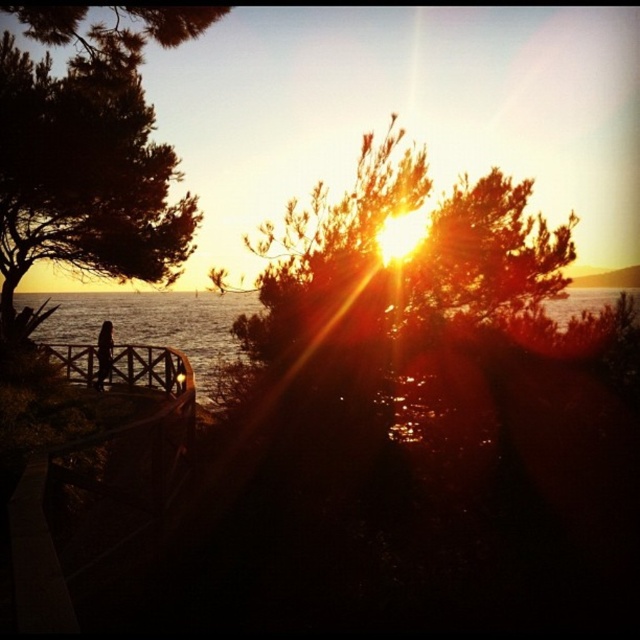
Question: Can you confirm if green leafy tree at left is smaller than translucent water at center?

Choices:
 (A) no
 (B) yes

Answer: (B)

Question: Which point is farther to the camera?

Choices:
 (A) wooden at left
 (B) silhouette wooden person at lower left

Answer: (B)

Question: Does clear blue water at lower left have a lesser width compared to wooden at left?

Choices:
 (A) no
 (B) yes

Answer: (A)

Question: Is green leafy tree at left above translucent water at center?

Choices:
 (A) yes
 (B) no

Answer: (A)

Question: Which point appears closest to the camera in this image?

Choices:
 (A) (96, 385)
 (B) (72, 353)
 (C) (548, 305)
 (D) (170, 307)

Answer: (C)

Question: Estimate the real-world distances between objects in this image. Which object is closer to the wooden at left?

Choices:
 (A) translucent water at center
 (B) clear blue water at lower left
 (C) green leafy tree at left
 (D) silhouette wooden person at lower left

Answer: (D)